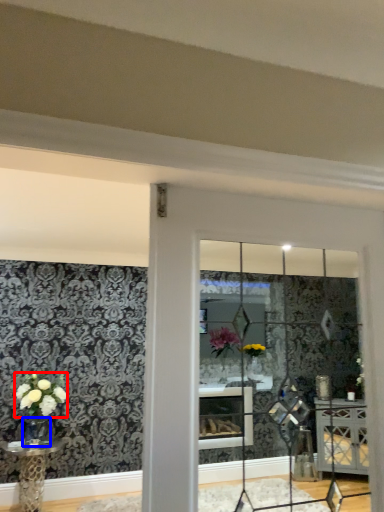
Question: Which object is further to the camera taking this photo, flower (highlighted by a red box) or glass vase (highlighted by a blue box)?

Choices:
 (A) flower
 (B) glass vase

Answer: (B)